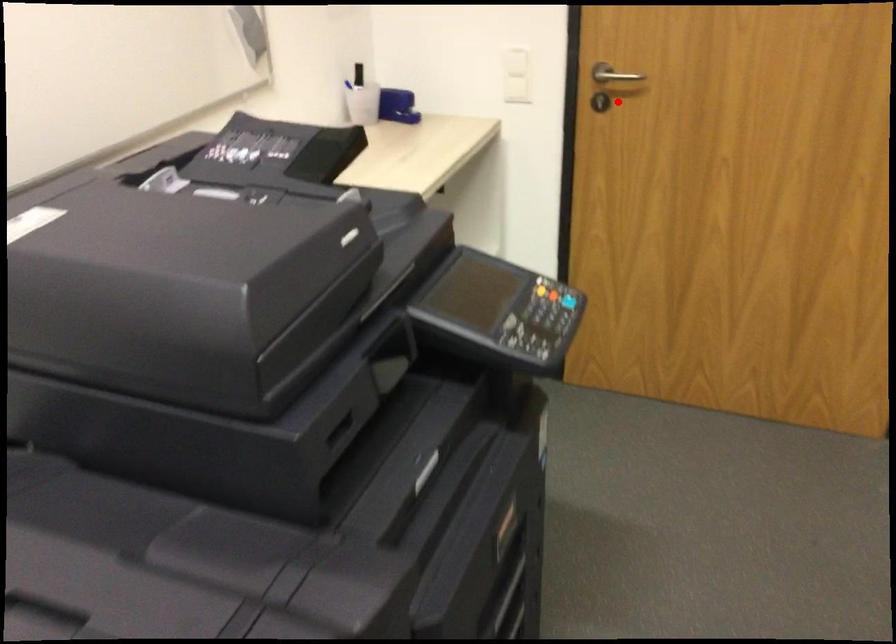
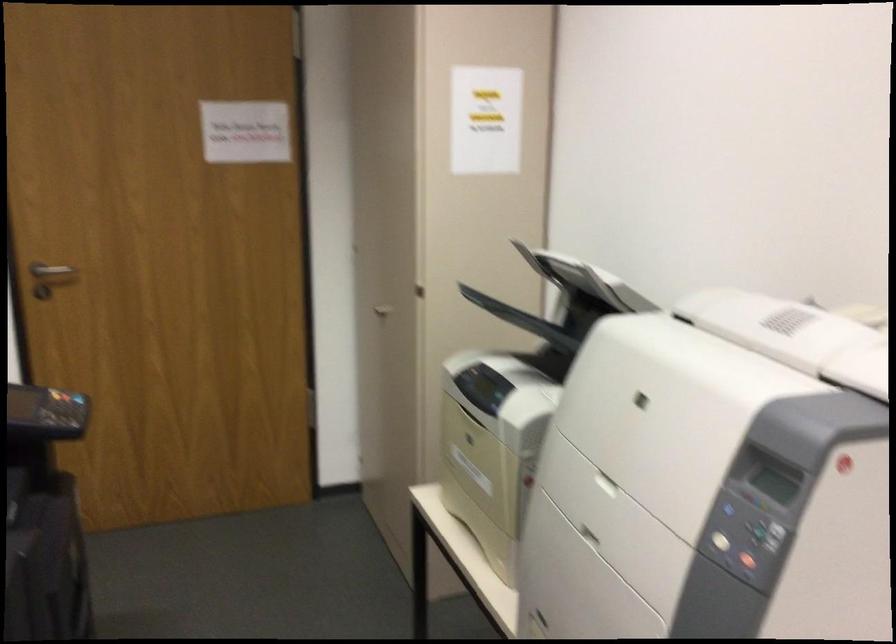
Where in the second image is the point corresponding to the highlighted location from the first image?

(52, 274)